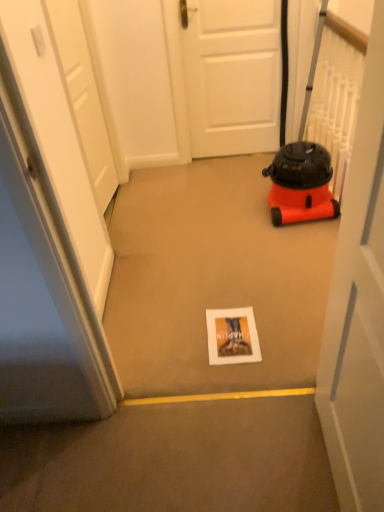
Question: From a real-world perspective, is white matte door at center, marked as the third door in a back-to-front arrangement, above or below matte paper postcard at center?

Choices:
 (A) above
 (B) below

Answer: (A)

Question: Is white matte door at center, acting as the 1th door starting from the right, wider or thinner than matte paper postcard at center?

Choices:
 (A) thin
 (B) wide

Answer: (A)

Question: Estimate the real-world distances between objects in this image. Which object is closer to the orange matte vacuum cleaner at right?

Choices:
 (A) white matte door at center, the second door from the right
 (B) matte paper postcard at center
 (C) white matte door at center, the first door viewed from the front
 (D) white matte door at upper left, the 1th door when ordered from left to right

Answer: (A)

Question: Which is farther from the white matte door at center, marked as the third door in a back-to-front arrangement?

Choices:
 (A) orange matte vacuum cleaner at right
 (B) white matte door at upper left, arranged as the 2th door when viewed from the front
 (C) white matte door at center, marked as the 3th door in a front-to-back arrangement
 (D) matte paper postcard at center

Answer: (C)